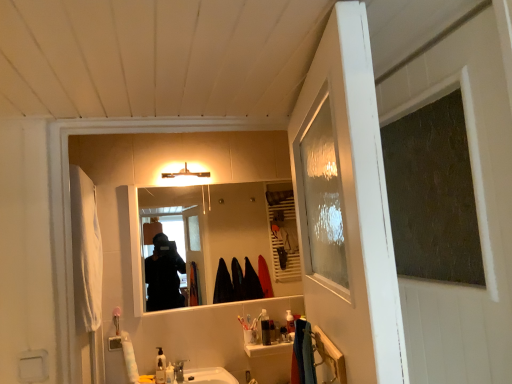
Question: Relative to translucent plastic soap dispenser at lower center, the 2th toiletry from the left, is smooth reflective mirror at center in front or behind?

Choices:
 (A) front
 (B) behind

Answer: (B)

Question: Would you say smooth reflective mirror at center is inside or outside translucent plastic soap dispenser at lower center, which is the 4th toiletry in right-to-left order?

Choices:
 (A) outside
 (B) inside

Answer: (A)

Question: Based on their relative distances, which object is farther from the matte white light fixture at upper center?

Choices:
 (A) smooth reflective mirror at center
 (B) clear glass screen door at right
 (C) translucent plastic toothbrush holder at center, the 2th toiletry from the back
 (D) translucent plastic soap dispenser at lower center, the 2th toiletry from the left
 (E) satin nickel faucet at sink center

Answer: (B)

Question: Estimate the real-world distances between objects in this image. Which object is closer to the matte white light fixture at upper center?

Choices:
 (A) satin nickel faucet at sink center
 (B) translucent plastic soap dispenser at lower center, the third toiletry from the left
 (C) smooth reflective mirror at center
 (D) translucent plastic toothbrush holder at center, arranged as the 4th toiletry when viewed from the front
 (E) translucent plastic soap dispenser at center, arranged as the 5th toiletry when viewed from the left

Answer: (D)